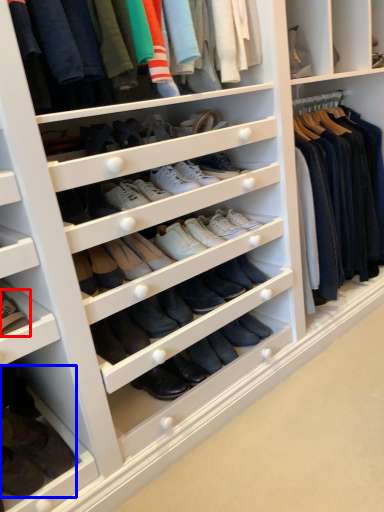
Question: Which of the following is the closest to the observer, footwear (highlighted by a red box) or footwear (highlighted by a blue box)?

Choices:
 (A) footwear
 (B) footwear

Answer: (B)